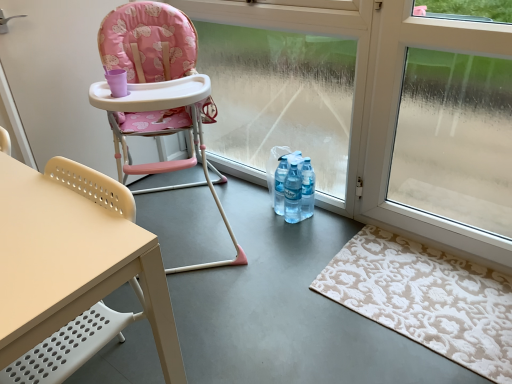
The height and width of the screenshot is (384, 512). Find the location of `vacant area on top of beige textured rug at lower right (from a real-world perspective)`. vacant area on top of beige textured rug at lower right (from a real-world perspective) is located at coordinates (424, 289).